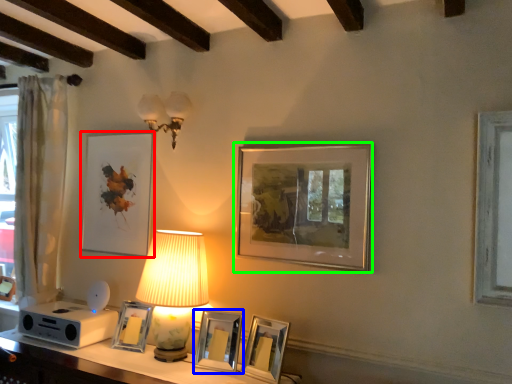
Question: Which object is positioned farthest from picture frame (highlighted by a red box)? Select from picture frame (highlighted by a blue box) and picture frame (highlighted by a green box).

Choices:
 (A) picture frame
 (B) picture frame

Answer: (B)